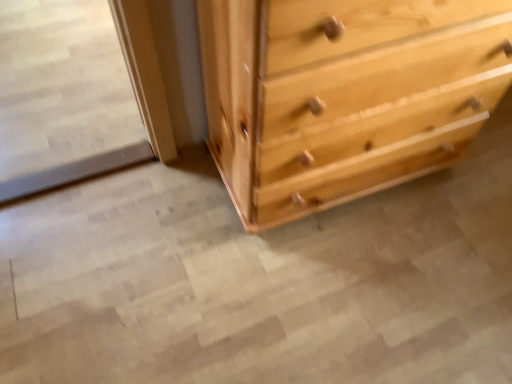
Question: Could clear glass screen door at left be considered to be inside natural wood chest of drawers at center?

Choices:
 (A) no
 (B) yes

Answer: (A)

Question: Is natural wood chest of drawers at center wider than clear glass screen door at left?

Choices:
 (A) yes
 (B) no

Answer: (B)

Question: Is natural wood chest of drawers at center at the right side of clear glass screen door at left?

Choices:
 (A) yes
 (B) no

Answer: (A)

Question: Considering the relative sizes of natural wood chest of drawers at center and clear glass screen door at left in the image provided, is natural wood chest of drawers at center shorter than clear glass screen door at left?

Choices:
 (A) no
 (B) yes

Answer: (A)

Question: Is natural wood chest of drawers at center far from clear glass screen door at left?

Choices:
 (A) no
 (B) yes

Answer: (A)

Question: Is the depth of natural wood chest of drawers at center greater than that of clear glass screen door at left?

Choices:
 (A) yes
 (B) no

Answer: (B)

Question: Considering the relative positions of clear glass screen door at left and natural wood chest of drawers at center in the image provided, is clear glass screen door at left behind natural wood chest of drawers at center?

Choices:
 (A) no
 (B) yes

Answer: (B)

Question: Does clear glass screen door at left turn towards natural wood chest of drawers at center?

Choices:
 (A) no
 (B) yes

Answer: (A)

Question: Considering the relative positions of clear glass screen door at left and natural wood chest of drawers at center in the image provided, is clear glass screen door at left to the left of natural wood chest of drawers at center from the viewer's perspective?

Choices:
 (A) yes
 (B) no

Answer: (A)

Question: Is clear glass screen door at left far away from natural wood chest of drawers at center?

Choices:
 (A) yes
 (B) no

Answer: (B)

Question: Considering the relative sizes of clear glass screen door at left and natural wood chest of drawers at center in the image provided, is clear glass screen door at left smaller than natural wood chest of drawers at center?

Choices:
 (A) yes
 (B) no

Answer: (A)

Question: Does clear glass screen door at left appear on the right side of natural wood chest of drawers at center?

Choices:
 (A) no
 (B) yes

Answer: (A)

Question: Considering the positions of clear glass screen door at left and natural wood chest of drawers at center in the image, is clear glass screen door at left taller or shorter than natural wood chest of drawers at center?

Choices:
 (A) tall
 (B) short

Answer: (B)